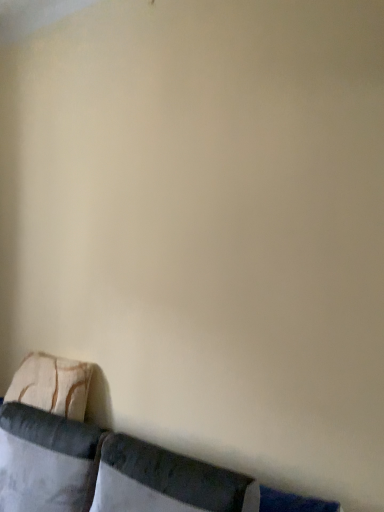
Question: Is velvet cushion at lower left further to camera compared to white fabric pillow at lower left, which appears as the 2th pillow when viewed from the back?

Choices:
 (A) yes
 (B) no

Answer: (B)

Question: Would you consider velvet cushion at lower left to be distant from white fabric pillow at lower left, which appears as the 2th pillow when viewed from the back?

Choices:
 (A) no
 (B) yes

Answer: (A)

Question: Is velvet cushion at lower left oriented towards white fabric pillow at lower left, the second pillow in the front-to-back sequence?

Choices:
 (A) yes
 (B) no

Answer: (A)

Question: Is velvet cushion at lower left outside white fabric pillow at lower left, which appears as the 2th pillow when viewed from the back?

Choices:
 (A) no
 (B) yes

Answer: (B)

Question: From the image's perspective, is velvet cushion at lower left on top of white fabric pillow at lower left, which appears as the 2th pillow when viewed from the back?

Choices:
 (A) no
 (B) yes

Answer: (A)

Question: From the image's perspective, does velvet cushion at lower left appear lower than white fabric pillow at lower left, which appears as the 2th pillow when viewed from the back?

Choices:
 (A) yes
 (B) no

Answer: (A)

Question: From a real-world perspective, is velvet dark gray pillow at lower center, which ranks as the 3th pillow in back-to-front order, over velvet cushion at lower left?

Choices:
 (A) yes
 (B) no

Answer: (A)

Question: Is velvet dark gray pillow at lower center, arranged as the first pillow when viewed from the front, wider than velvet cushion at lower left?

Choices:
 (A) yes
 (B) no

Answer: (B)

Question: Does velvet dark gray pillow at lower center, which ranks as the 3th pillow in back-to-front order, have a lesser width compared to velvet cushion at lower left?

Choices:
 (A) no
 (B) yes

Answer: (B)

Question: Does velvet dark gray pillow at lower center, arranged as the first pillow when viewed from the front, appear on the right side of velvet cushion at lower left?

Choices:
 (A) yes
 (B) no

Answer: (A)

Question: From the image's perspective, does velvet dark gray pillow at lower center, arranged as the first pillow when viewed from the front, appear lower than velvet cushion at lower left?

Choices:
 (A) yes
 (B) no

Answer: (B)

Question: Considering the relative sizes of velvet dark gray pillow at lower center, arranged as the first pillow when viewed from the front, and velvet cushion at lower left in the image provided, is velvet dark gray pillow at lower center, arranged as the first pillow when viewed from the front, shorter than velvet cushion at lower left?

Choices:
 (A) yes
 (B) no

Answer: (A)

Question: Does white fabric pillow at lower left, the second pillow in the front-to-back sequence, lie in front of velvet cushion at lower left?

Choices:
 (A) yes
 (B) no

Answer: (B)